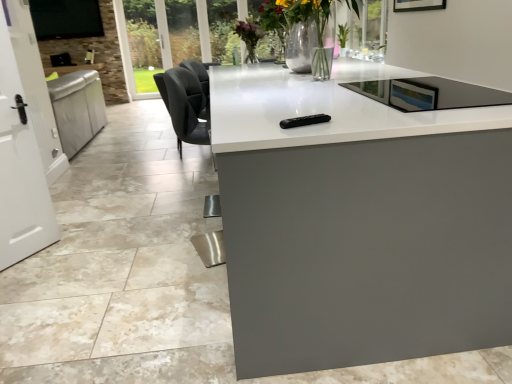
Find the location of a particular element. free space in front of black leather swivel chair at center is located at coordinates (175, 168).